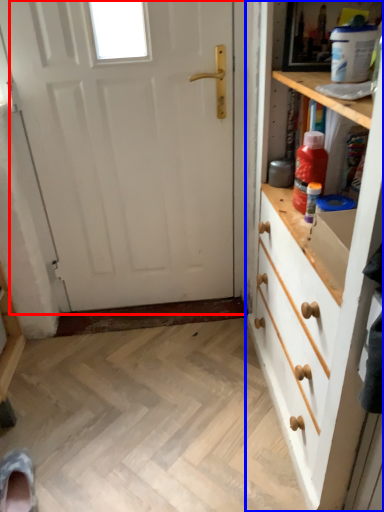
Question: Which object appears closest to the camera in this image, door (highlighted by a red box) or chest of drawers (highlighted by a blue box)?

Choices:
 (A) door
 (B) chest of drawers

Answer: (B)